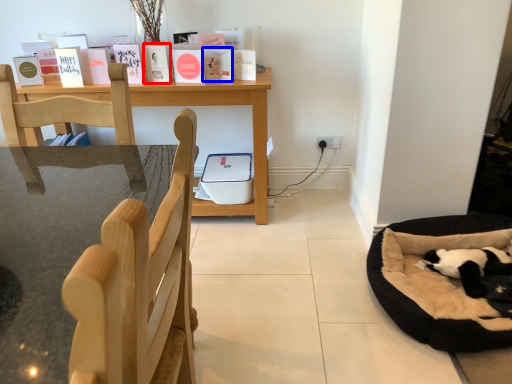
Question: Which object is further to the camera taking this photo, paperback book (highlighted by a red box) or paperback book (highlighted by a blue box)?

Choices:
 (A) paperback book
 (B) paperback book

Answer: (B)